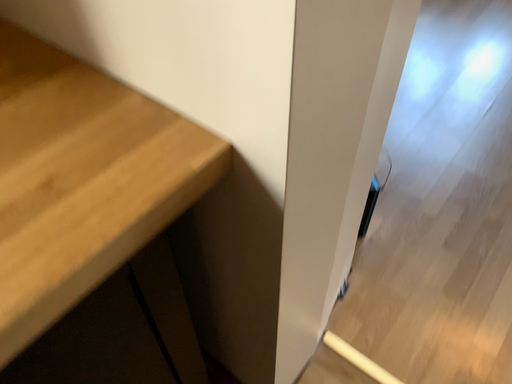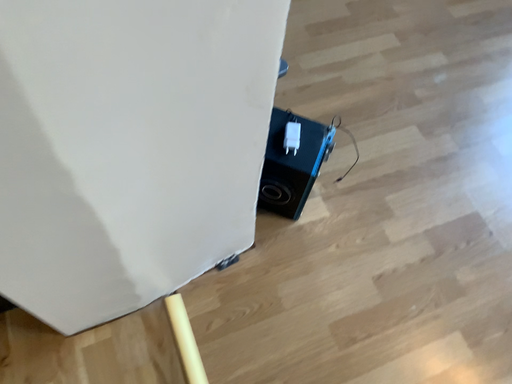
Question: How did the camera likely rotate when shooting the video?

Choices:
 (A) rotated upward
 (B) rotated downward

Answer: (B)